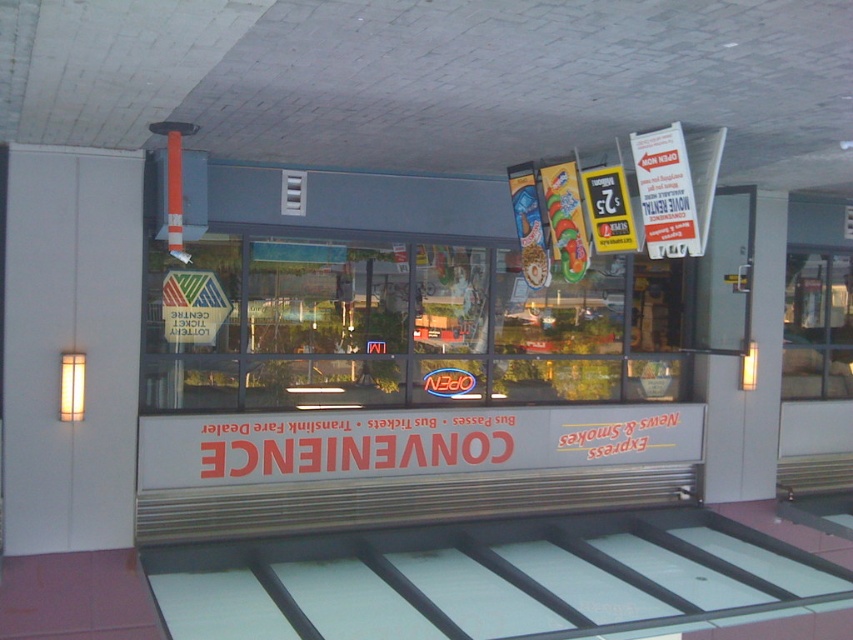
Question: Does white paper sign at upper right have a larger size compared to yellow paper sign at center?

Choices:
 (A) no
 (B) yes

Answer: (B)

Question: Can you confirm if white paper sign at upper right is smaller than yellow paper sign at center?

Choices:
 (A) no
 (B) yes

Answer: (A)

Question: Is white paper sign at upper right wider than yellow paper sign at center?

Choices:
 (A) yes
 (B) no

Answer: (A)